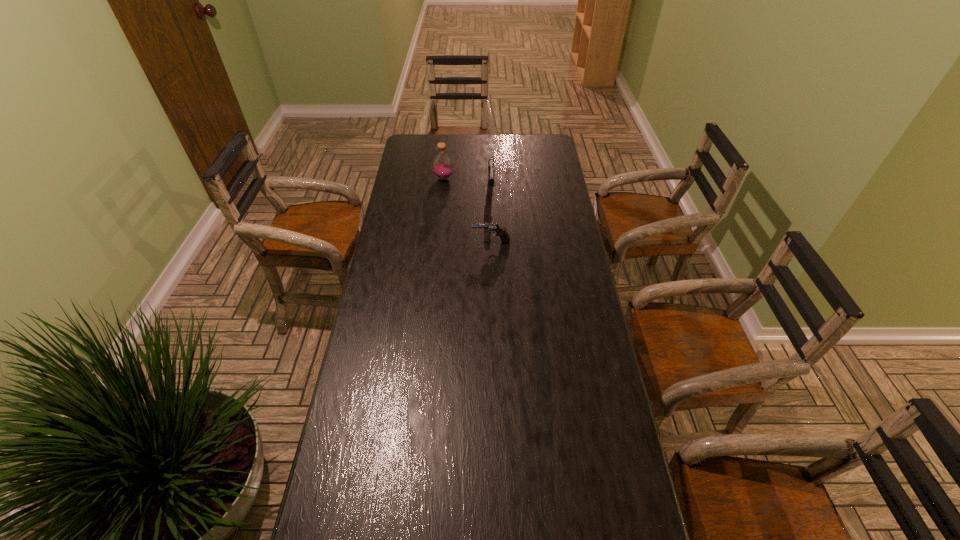
Locate an element on the screen. free space that is in between the leftmost object and the second tallest object is located at coordinates (468, 185).

Find the location of a particular element. The width and height of the screenshot is (960, 540). empty space between the shortest object and the farther pistol is located at coordinates (492, 217).

Where is `object that ranks as the closest to the nearest object`? The height and width of the screenshot is (540, 960). object that ranks as the closest to the nearest object is located at coordinates (491, 170).

Identify which object is located as the nearest to the farther pistol. Please provide its 2D coordinates. Your answer should be formatted as a tuple, i.e. [(x, y)], where the tuple contains the x and y coordinates of a point satisfying the conditions above.

[(442, 165)]

The image size is (960, 540). In order to click on free location that satisfies the following two spatial constraints: 1. aim along the barrel of the second tallest object; 2. at the barrel of the shortest object in this screenshot , I will do pos(492,242).